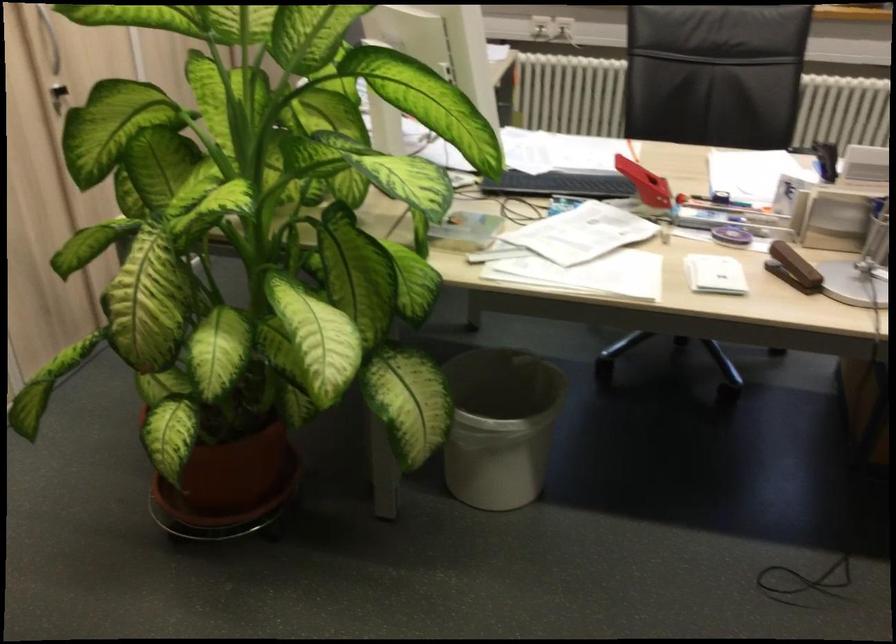
This screenshot has height=644, width=896. Find the location of `white memo pad`. white memo pad is located at coordinates (714, 274).